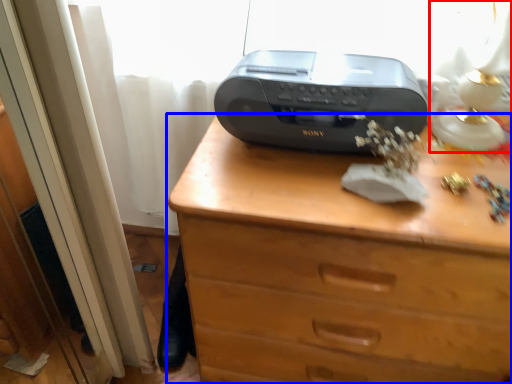
Question: Which object appears farthest to the camera in this image, table lamp (highlighted by a red box) or chest of drawers (highlighted by a blue box)?

Choices:
 (A) table lamp
 (B) chest of drawers

Answer: (B)